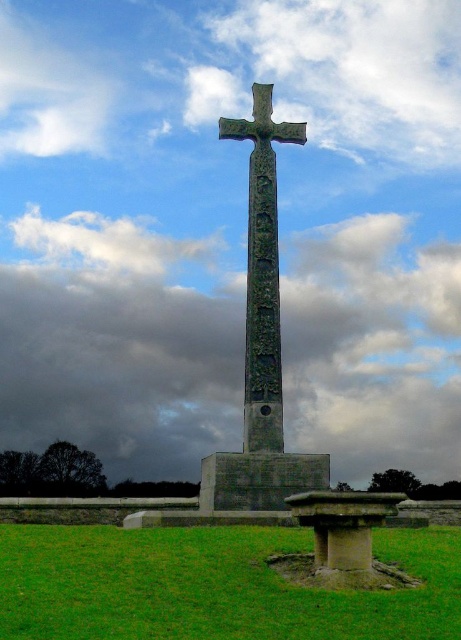
Question: Which object is positioned closest to the green grass at lower center?

Choices:
 (A) green stone cross at center
 (B) cloudy sky at center

Answer: (A)

Question: From the image, what is the correct spatial relationship of green grass at lower center in relation to green stone cross at center?

Choices:
 (A) left
 (B) right

Answer: (A)

Question: In this image, where is green grass at lower center located relative to green stone cross at center?

Choices:
 (A) above
 (B) below

Answer: (B)

Question: Is green grass at lower center smaller than green stone cross at center?

Choices:
 (A) yes
 (B) no

Answer: (B)

Question: Among these objects, which one is farthest from the camera?

Choices:
 (A) green stone cross at center
 (B) cloudy sky at center

Answer: (B)

Question: Which object is closer to the camera taking this photo?

Choices:
 (A) green stone cross at center
 (B) green grass at lower center
 (C) cloudy sky at center

Answer: (B)